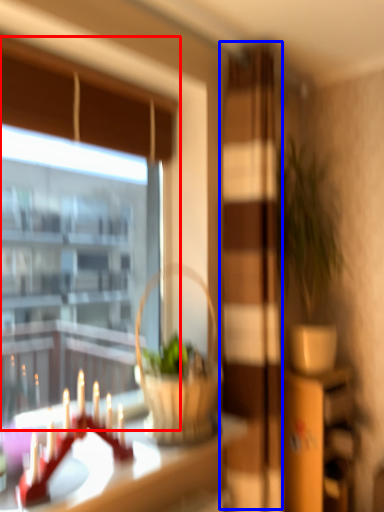
Question: Which point is closer to the camera, window (highlighted by a red box) or screen door (highlighted by a blue box)?

Choices:
 (A) window
 (B) screen door

Answer: (A)